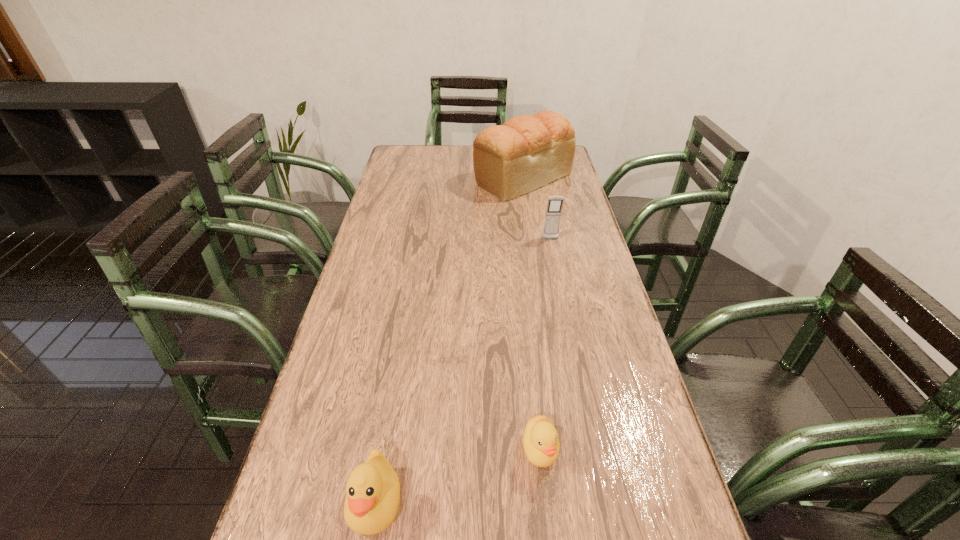
The width and height of the screenshot is (960, 540). Identify the location of cellular telephone positioned at the right edge. (554, 206).

Where is `object located at the far right corner`? Image resolution: width=960 pixels, height=540 pixels. object located at the far right corner is located at coordinates (528, 151).

The image size is (960, 540). In order to click on free space at the left edge in this screenshot , I will do `click(377, 217)`.

Locate an element on the screen. The width and height of the screenshot is (960, 540). free space at the right edge of the desktop is located at coordinates [569, 360].

Find the location of a particular element. free space between the shorter duck and the tallest object is located at coordinates (532, 314).

At what (x,y) coordinates should I click in order to perform the action: click on empty space between the cellular telephone and the shortest object. Please return your answer as a coordinate pair (x, y). Looking at the image, I should click on (545, 344).

Identify which object is located as the nearest to the cellular telephone. Please provide its 2D coordinates. Your answer should be formatted as a tuple, i.e. [(x, y)], where the tuple contains the x and y coordinates of a point satisfying the conditions above.

[(528, 151)]

Identify the location of object that is the second closest to the third shortest object. (541, 444).